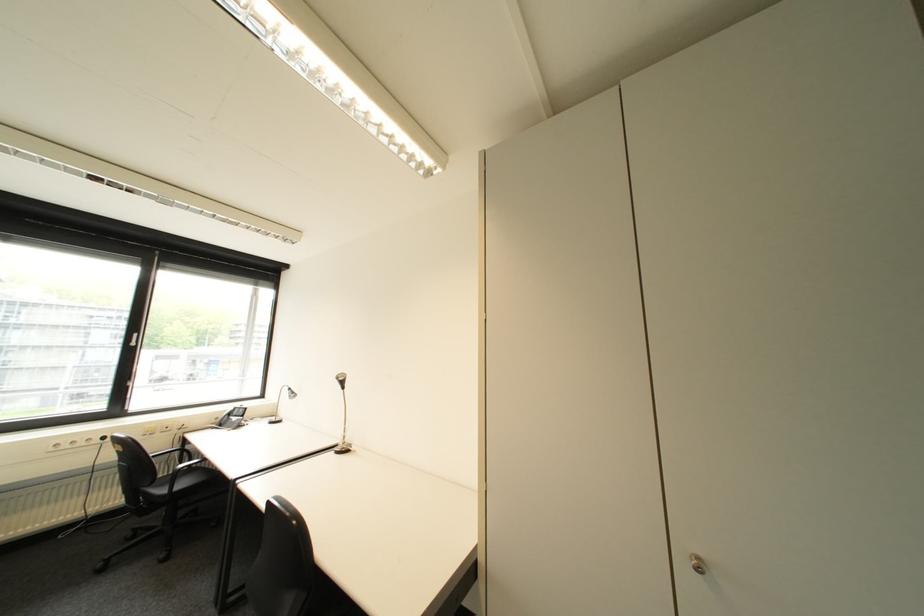
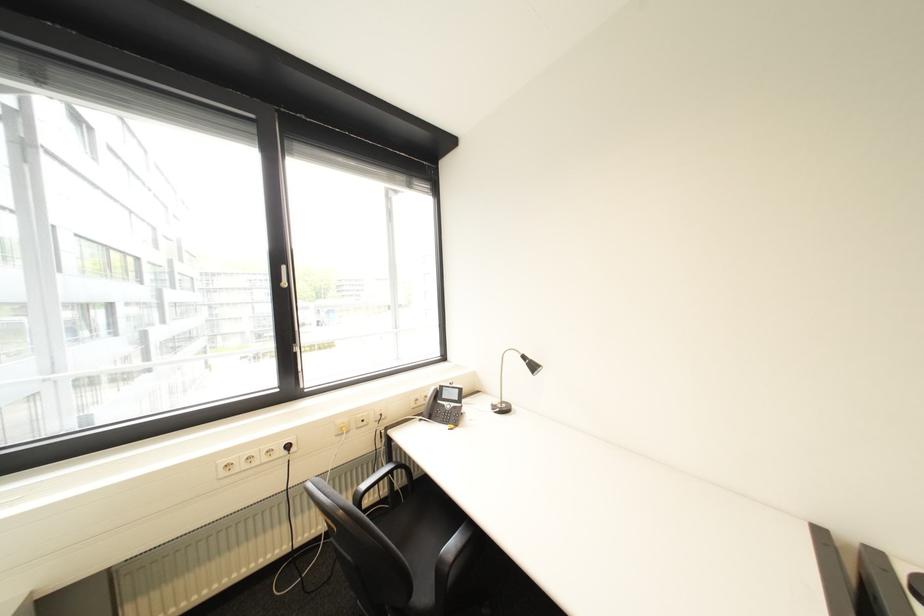
The images are taken continuously from a first-person perspective. In which direction are you moving?

The cameraman walked toward left, forward.